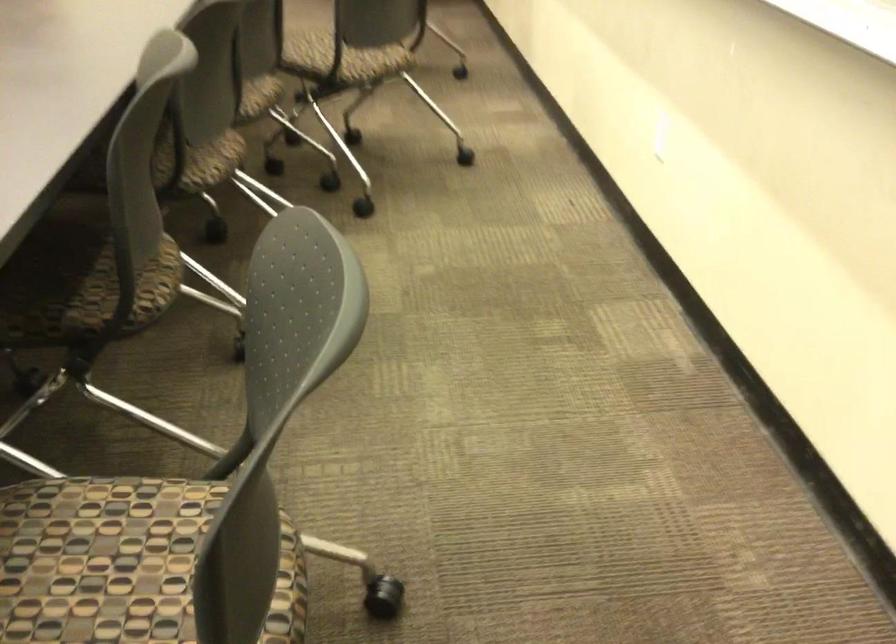
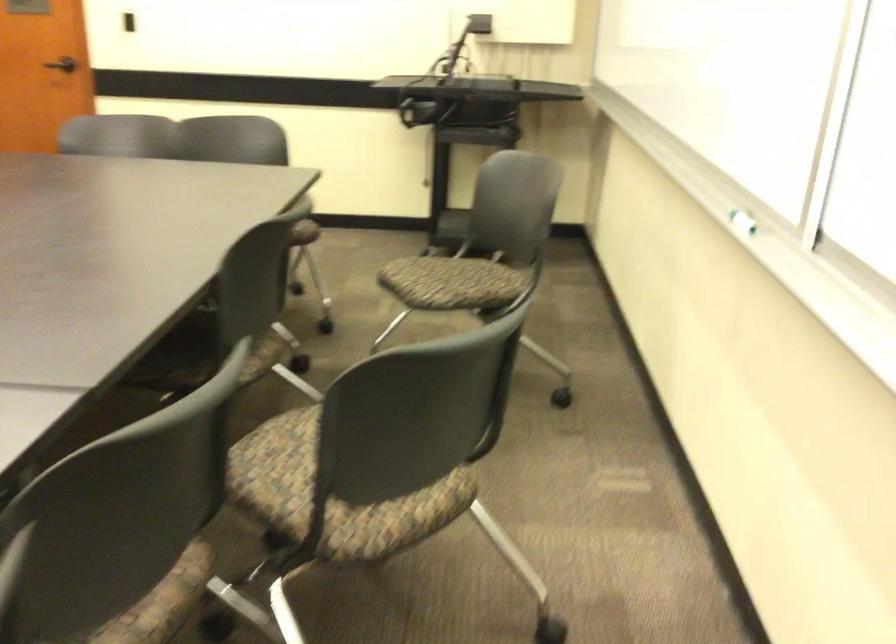
Question: In a continuous first-person perspective shot, in which direction is the camera moving?

Choices:
 (A) Left
 (B) Right
 (C) Forward
 (D) Backward

Answer: (C)